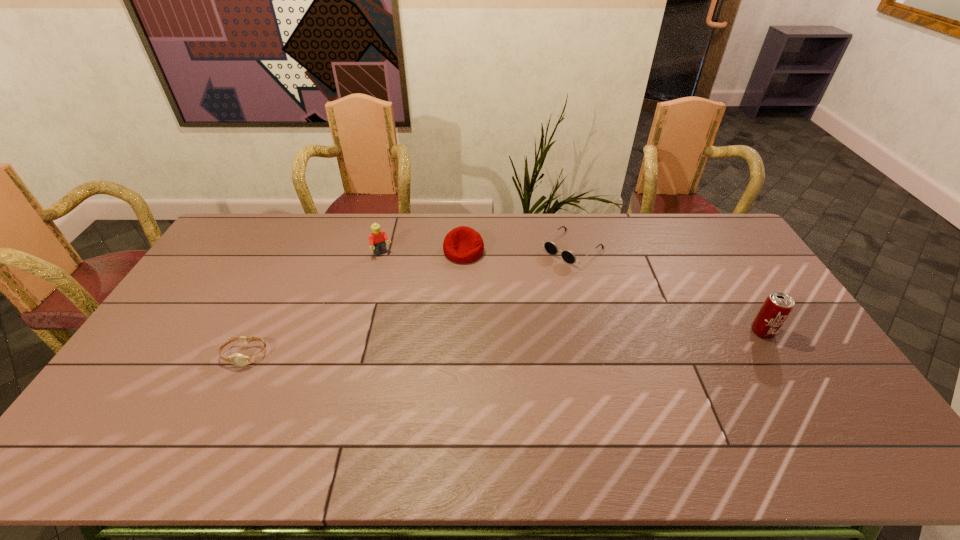
This screenshot has width=960, height=540. What are the coordinates of `free area in between the third tallest object and the beer can` in the screenshot? It's located at (612, 292).

This screenshot has height=540, width=960. I want to click on vacant space that's between the fourth object from left to right and the rightmost object, so click(x=667, y=290).

Identify the location of empty location between the watch and the fourth object from left to right. The height and width of the screenshot is (540, 960). (408, 302).

You are a GUI agent. You are given a task and a screenshot of the screen. Output one action in this format:
    pyautogui.click(x=<x>, y=<y>)
    Task: Click on the vacant area that lies between the third tallest object and the beer can
    
    Given the screenshot: What is the action you would take?
    pyautogui.click(x=612, y=292)

Image resolution: width=960 pixels, height=540 pixels. What are the coordinates of `vacant point located between the fourth object from right to left and the beanbag` in the screenshot? It's located at (423, 253).

In order to click on free area in between the leftmost object and the fourth object from left to right in this screenshot , I will do `click(408, 302)`.

At what (x,y) coordinates should I click in order to perform the action: click on vacant area that lies between the watch and the beer can. Please return your answer as a coordinate pair (x, y). Looking at the image, I should click on (503, 343).

Locate an element on the screen. This screenshot has height=540, width=960. vacant space in between the watch and the third object from right to left is located at coordinates (354, 303).

Find the location of a particular element. The height and width of the screenshot is (540, 960). free space between the sunglasses and the beer can is located at coordinates (667, 290).

You are a GUI agent. You are given a task and a screenshot of the screen. Output one action in this format:
    pyautogui.click(x=<x>, y=<y>)
    Task: Click on the object that can be found as the closest to the Lego
    This screenshot has width=960, height=540.
    Given the screenshot: What is the action you would take?
    pyautogui.click(x=463, y=244)